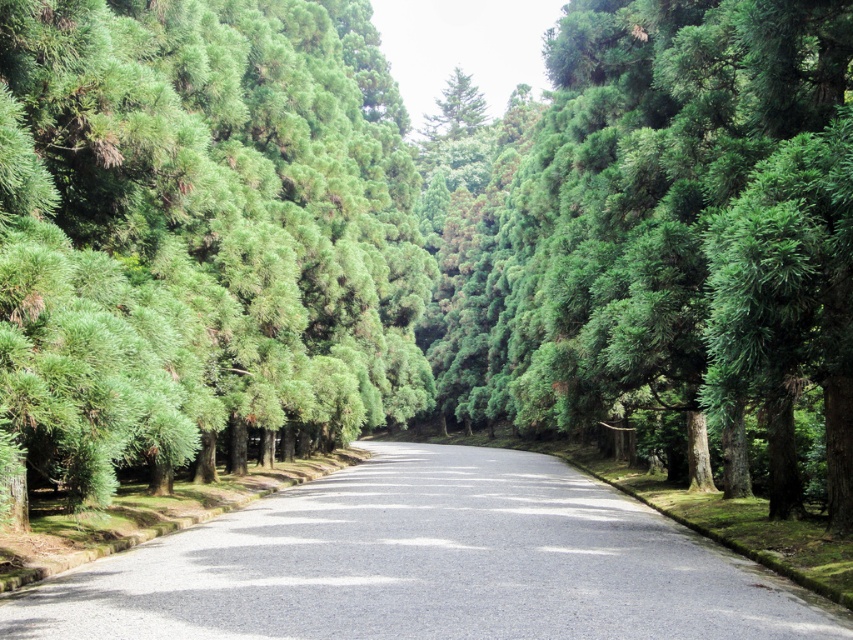
You are driving a car that is 4.5 meters long. You see the green leafy trees at left and the asphalt road at center. Can your car fit between them without touching the trees?

The distance between the green leafy trees at left and the asphalt road at center is 7.71 meters. Since your car is only 4.5 meters long, it can fit between them without touching the trees.